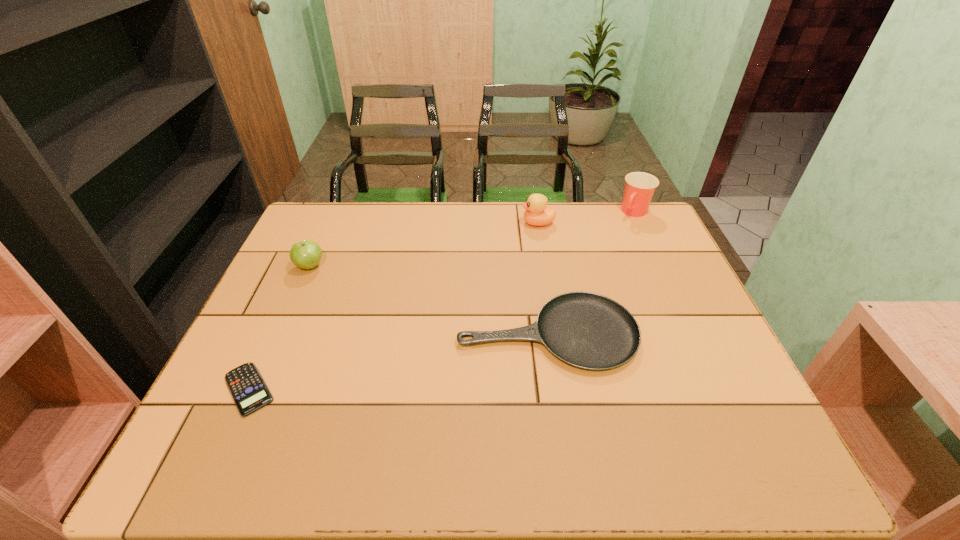
This screenshot has height=540, width=960. In order to click on free point between the calculator and the frying pan in this screenshot , I will do `click(398, 361)`.

At what (x,y) coordinates should I click in order to perform the action: click on vacant area that lies between the rightmost object and the apple. Please return your answer as a coordinate pair (x, y). Looking at the image, I should click on (472, 239).

Where is `empty space that is in between the rightmost object and the frying pan`? empty space that is in between the rightmost object and the frying pan is located at coordinates (591, 273).

Select which object appears as the closest to the fourth tallest object. Please provide its 2D coordinates. Your answer should be formatted as a tuple, i.e. [(x, y)], where the tuple contains the x and y coordinates of a point satisfying the conditions above.

[(536, 213)]

Locate which object ranks third in proximity to the rightmost object. Please provide its 2D coordinates. Your answer should be formatted as a tuple, i.e. [(x, y)], where the tuple contains the x and y coordinates of a point satisfying the conditions above.

[(306, 254)]

At what (x,y) coordinates should I click in order to perform the action: click on blank space that satisfies the following two spatial constraints: 1. on the back side of the frying pan; 2. on the left side of the rightmost object. Please return your answer as a coordinate pair (x, y). Looking at the image, I should click on (529, 212).

Where is `vacant area that satisfies the following two spatial constraints: 1. on the back side of the rightmost object; 2. on the right side of the calculator`? The image size is (960, 540). vacant area that satisfies the following two spatial constraints: 1. on the back side of the rightmost object; 2. on the right side of the calculator is located at coordinates (329, 212).